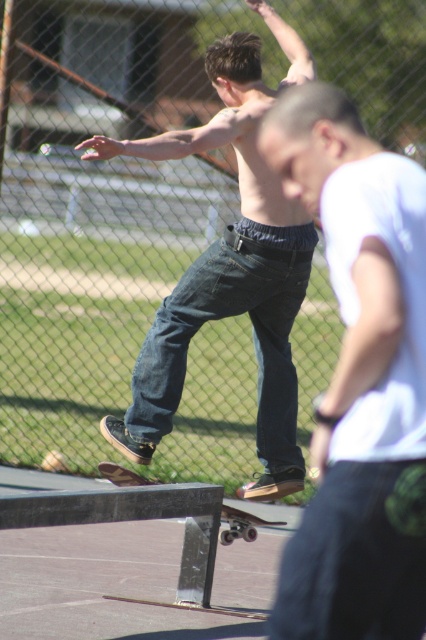
You are standing at the entrance of the skatepark and see the point marked at coordinates (359,380). What object is located at that point?

The white matte shirt at center is located at point (359,380).

You are a photographer at the skatepark. You want to capture a photo of the white matte shirt at center and the wooden skateboard at center. Which one should you focus on first if you want to prioritize the closer object?

The white matte shirt at center is taller than the wooden skateboard at center, so it is closer to the camera. Therefore, you should focus on the white matte shirt at center first.